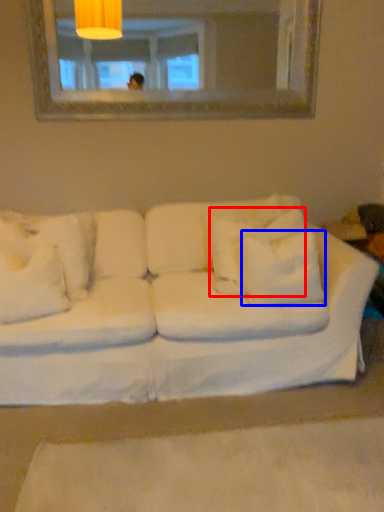
Question: Which point is closer to the camera, pillow (highlighted by a red box) or pillow (highlighted by a blue box)?

Choices:
 (A) pillow
 (B) pillow

Answer: (B)